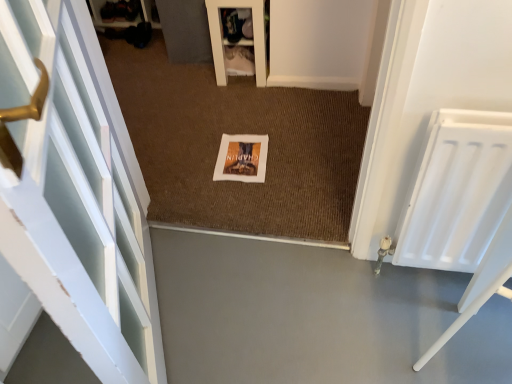
What is the approximate height of brown textured mat at center?

brown textured mat at center is 2.21 inches in height.

In order to click on white matte radiator at right in this screenshot , I will do coord(457,191).

This screenshot has height=384, width=512. What are the coordinates of `white fabric shoe rack at upper center` in the screenshot? It's located at (240, 38).

Is the position of white painted wood door at left more distant than that of white matte picture frame at center?

No, white painted wood door at left is in front of white matte picture frame at center.

The image size is (512, 384). What are the coordinates of `door above the white matte picture frame at center (from a real-world perspective)` in the screenshot? It's located at (75, 201).

Measure the distance between white painted wood door at left and white matte picture frame at center.

A distance of 27.99 inches exists between white painted wood door at left and white matte picture frame at center.

Between white painted wood door at left and white matte picture frame at center, which one has larger width?

With larger width is white matte picture frame at center.

From a real-world perspective, is white matte radiator at right physically located above or below gray smooth concrete at center?

white matte radiator at right is situated higher than gray smooth concrete at center in the real world.

Is white matte radiator at right shorter than gray smooth concrete at center?

No.

From the picture: Does white matte radiator at right turn towards gray smooth concrete at center?

No.

What's the angular difference between white matte radiator at right and gray smooth concrete at center's facing directions?

179 degrees.

Is brown textured mat at center at the left side of white fabric shoe rack at upper center?

Correct, you'll find brown textured mat at center to the left of white fabric shoe rack at upper center.

Is brown textured mat at center situated inside white fabric shoe rack at upper center or outside?

brown textured mat at center cannot be found inside white fabric shoe rack at upper center.

Does brown textured mat at center turn towards white fabric shoe rack at upper center?

No, brown textured mat at center is not facing towards white fabric shoe rack at upper center.

From the image's perspective, which one is positioned lower, white fabric shoe rack at upper center or gray smooth concrete at center?

gray smooth concrete at center.

Looking at this image, is the surface of white fabric shoe rack at upper center in direct contact with gray smooth concrete at center?

white fabric shoe rack at upper center is not next to gray smooth concrete at center, and they're not touching.

Is white fabric shoe rack at upper center in front of or behind gray smooth concrete at center in the image?

white fabric shoe rack at upper center is positioned farther from the viewer than gray smooth concrete at center.

Is gray smooth concrete at center oriented away from white matte radiator at right?

gray smooth concrete at center is not turned away from white matte radiator at right.

Can you tell me how much gray smooth concrete at center and white matte radiator at right differ in facing direction?

The facing directions of gray smooth concrete at center and white matte radiator at right are 179 degrees apart.

From a real-world perspective, which object stands above the other?

In real-world perspective, white matte radiator at right is above.

Is gray smooth concrete at center to the left of white matte radiator at right from the viewer's perspective?

Indeed, gray smooth concrete at center is positioned on the left side of white matte radiator at right.

Based on the photo, does white painted wood door at left appear on the right side of white matte radiator at right?

No.

Locate an element on the screen. This screenshot has height=384, width=512. door in front of the white matte radiator at right is located at coordinates (75, 201).

From the image's perspective, is white painted wood door at left below white matte radiator at right?

No, from the image's perspective, white painted wood door at left is not below white matte radiator at right.

Between white matte picture frame at center and white painted wood door at left, which one has larger width?

Wider between the two is white matte picture frame at center.

Based on the photo, measure the distance from white matte picture frame at center to white painted wood door at left.

white matte picture frame at center and white painted wood door at left are 27.99 inches apart from each other.

Is point (266, 162) farther from camera compared to point (67, 290)?

That is True.

The image size is (512, 384). Identify the location of picture frame that is above the white painted wood door at left (from the image's perspective). (242, 158).

The image size is (512, 384). Find the location of `radiator on the right of gray smooth concrete at center`. radiator on the right of gray smooth concrete at center is located at coordinates point(457,191).

Which object lies nearer to the anchor point gray smooth concrete at center, white matte picture frame at center or white matte radiator at right?

Among the two, white matte radiator at right is located nearer to gray smooth concrete at center.

Considering their positions, is gray smooth concrete at center positioned closer to white matte picture frame at center than white painted wood door at left?

gray smooth concrete at center.

Considering their positions, is white fabric shoe rack at upper center positioned further to gray smooth concrete at center than white painted wood door at left?

white fabric shoe rack at upper center.

Considering their positions, is white fabric shoe rack at upper center positioned further to white matte picture frame at center than white painted wood door at left?

Based on the image, white painted wood door at left appears to be further to white matte picture frame at center.

From the image, which object appears to be nearer to white fabric shoe rack at upper center, brown textured mat at center or gray smooth concrete at center?

brown textured mat at center.

Estimate the real-world distances between objects in this image. Which object is further from white painted wood door at left, white matte picture frame at center or brown textured mat at center?

Based on the image, white matte picture frame at center appears to be further to white painted wood door at left.

From the image, which object appears to be farther from white matte radiator at right, white painted wood door at left or gray smooth concrete at center?

white painted wood door at left is further to white matte radiator at right.

When comparing their distances from brown textured mat at center, does white matte radiator at right or white fabric shoe rack at upper center seem further?

white matte radiator at right is positioned further to the anchor brown textured mat at center.

This screenshot has height=384, width=512. In order to click on radiator that lies between brown textured mat at center and gray smooth concrete at center from top to bottom in this screenshot , I will do `click(457, 191)`.

At what (x,y) coordinates should I click in order to perform the action: click on picture frame positioned between white matte radiator at right and white fabric shoe rack at upper center from near to far. Please return your answer as a coordinate pair (x, y). The image size is (512, 384). Looking at the image, I should click on (242, 158).

What are the coordinates of `picture frame located between brown textured mat at center and white matte radiator at right in the left-right direction` in the screenshot? It's located at 242,158.

Identify the location of radiator between white painted wood door at left and brown textured mat at center in the front-back direction. The image size is (512, 384). (457, 191).